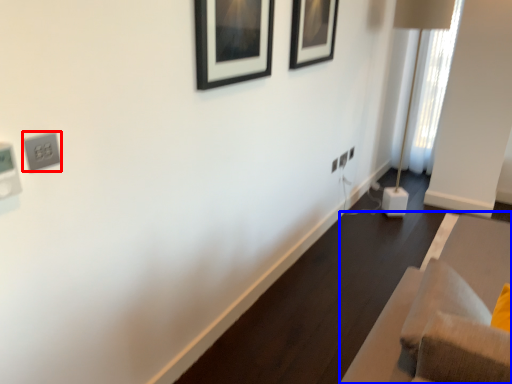
Question: Which object is further to the camera taking this photo, electric outlet (highlighted by a red box) or furniture (highlighted by a blue box)?

Choices:
 (A) electric outlet
 (B) furniture

Answer: (A)